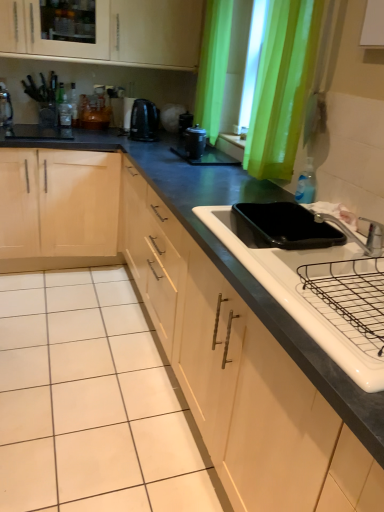
Identify the location of vacant space that is to the left of green fabric curtain at upper right. (216, 170).